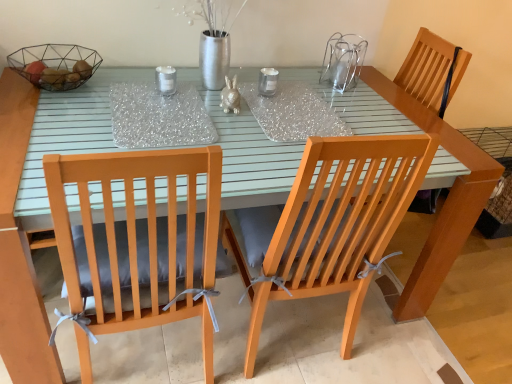
Where is `vacant space in front of metallic wire basket at upper left`? This screenshot has width=512, height=384. vacant space in front of metallic wire basket at upper left is located at coordinates (45, 112).